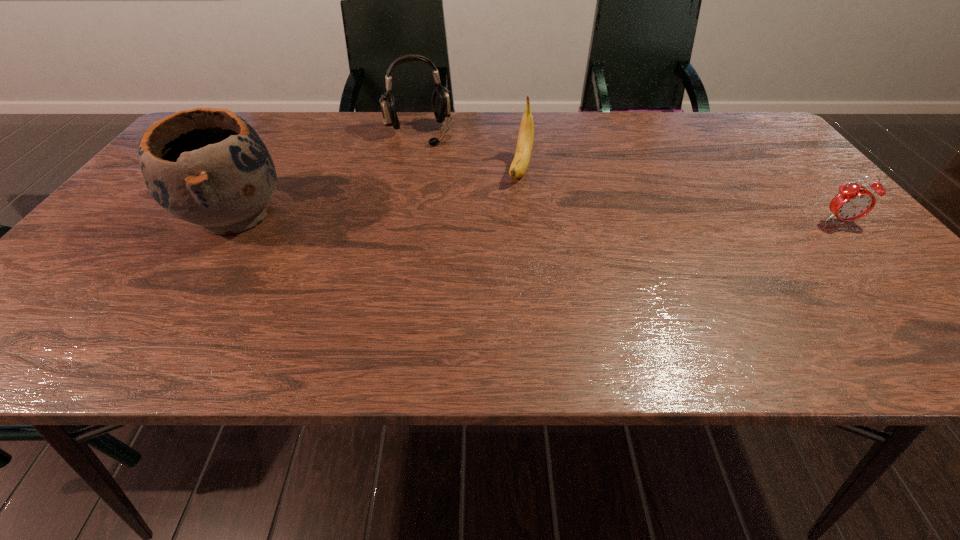
Identify the location of vacant region between the second shortest object and the farthest object. (469, 151).

Where is `free space between the third object from left to right and the headset`? This screenshot has height=540, width=960. free space between the third object from left to right and the headset is located at coordinates (469, 151).

Locate an element on the screen. The image size is (960, 540). free spot between the third object from left to right and the pottery is located at coordinates (377, 192).

Identify the location of empty space that is in between the pottery and the third tallest object. (377, 192).

What are the coordinates of `free spot between the banana and the shortest object` in the screenshot? It's located at (681, 195).

Locate which object ranks second in proximity to the farthest object. Please provide its 2D coordinates. Your answer should be formatted as a tuple, i.e. [(x, y)], where the tuple contains the x and y coordinates of a point satisfying the conditions above.

[(207, 166)]

Identify which object is located as the third nearest to the leftmost object. Please provide its 2D coordinates. Your answer should be formatted as a tuple, i.e. [(x, y)], where the tuple contains the x and y coordinates of a point satisfying the conditions above.

[(853, 201)]

The image size is (960, 540). Find the location of `vacant space that satisfies the following two spatial constraints: 1. on the front side of the third object from left to right; 2. on the right side of the farthest object`. vacant space that satisfies the following two spatial constraints: 1. on the front side of the third object from left to right; 2. on the right side of the farthest object is located at coordinates (411, 169).